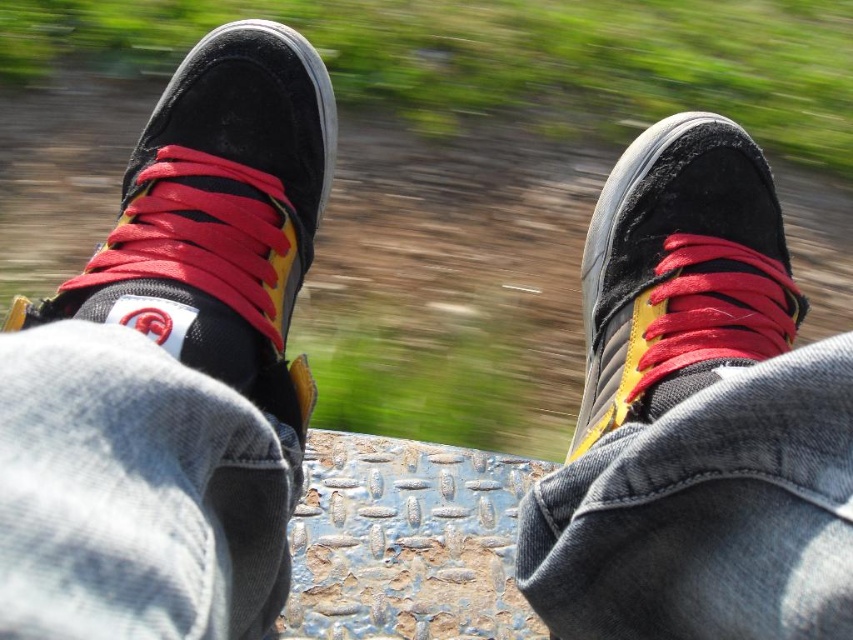
Can you confirm if suede/black shoe at upper left is positioned to the left of suede/black shoe at center?

Correct, you'll find suede/black shoe at upper left to the left of suede/black shoe at center.

Between suede/black shoe at upper left and suede/black shoe at center, which one has less height?

Standing shorter between the two is suede/black shoe at center.

The height and width of the screenshot is (640, 853). Describe the element at coordinates (219, 216) in the screenshot. I see `suede/black shoe at upper left` at that location.

The height and width of the screenshot is (640, 853). Find the location of `suede/black shoe at upper left`. suede/black shoe at upper left is located at coordinates (219, 216).